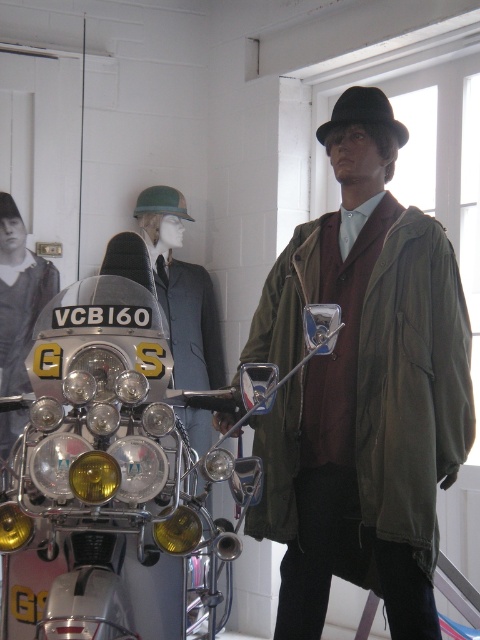
In the scene shown: Does olive green fabric jacket at center have a greater height compared to black felt fedora at upper center?

Yes, olive green fabric jacket at center is taller than black felt fedora at upper center.

Does point (432, 330) come farther from viewer compared to point (360, 92)?

No, (432, 330) is closer to viewer.

Where is `olive green fabric jacket at center`? Image resolution: width=480 pixels, height=640 pixels. olive green fabric jacket at center is located at coordinates point(408,396).

Looking at this image, does matte black jacket at center appear under black felt fedora at upper center?

Yes, matte black jacket at center is below black felt fedora at upper center.

The width and height of the screenshot is (480, 640). Describe the element at coordinates (19, 296) in the screenshot. I see `matte black jacket at center` at that location.

Does point (6, 275) come in front of point (396, 124)?

No, (6, 275) is further to viewer.

You are a GUI agent. You are given a task and a screenshot of the screen. Output one action in this format:
    pyautogui.click(x=<x>, y=<y>)
    Task: Click on the matte black jacket at center
    
    Given the screenshot: What is the action you would take?
    pyautogui.click(x=19, y=296)

Between point (338, 545) and point (56, 282), which one is positioned behind?

Point (56, 282)

What do you see at coordinates (408, 396) in the screenshot? This screenshot has height=640, width=480. I see `olive green fabric jacket at center` at bounding box center [408, 396].

Image resolution: width=480 pixels, height=640 pixels. What are the coordinates of `olive green fabric jacket at center` in the screenshot? It's located at (408, 396).